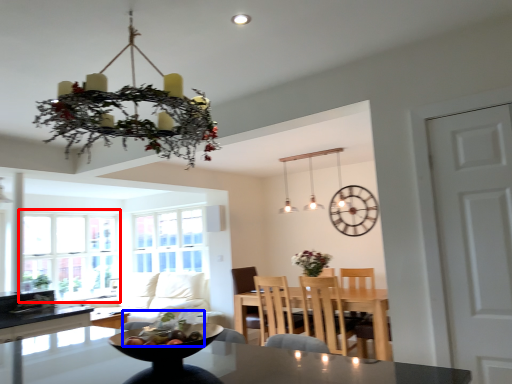
Question: Which object is closer to the camera taking this photo, window (highlighted by a red box) or food (highlighted by a blue box)?

Choices:
 (A) window
 (B) food

Answer: (B)